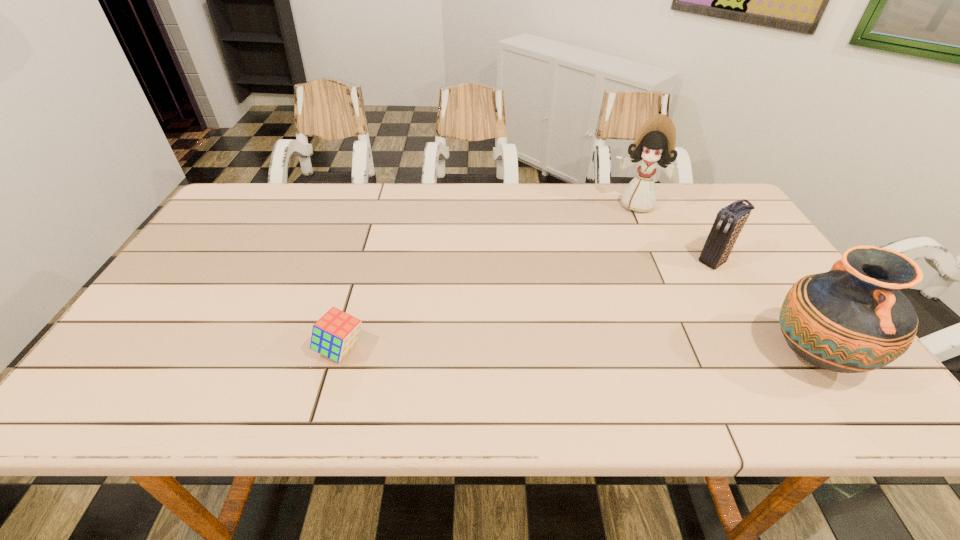
I want to click on free space located with the zip open on the clutch bag, so click(x=663, y=294).

This screenshot has height=540, width=960. In order to click on free space located 0.320m with the zip open on the clutch bag in this screenshot , I will do `click(624, 319)`.

Identify the location of free space located 0.270m at the front face of the third object from right to left. (619, 271).

Where is `free space located 0.220m at the front face of the third object from right to left`? This screenshot has height=540, width=960. free space located 0.220m at the front face of the third object from right to left is located at coordinates (622, 260).

Where is `free space located 0.360m at the front face of the third object from right to left`? This screenshot has width=960, height=540. free space located 0.360m at the front face of the third object from right to left is located at coordinates (614, 293).

You are a GUI agent. You are given a task and a screenshot of the screen. Output one action in this format:
    pyautogui.click(x=<x>, y=<y>)
    Task: Click on the object positioned at the far edge
    The height and width of the screenshot is (540, 960).
    Given the screenshot: What is the action you would take?
    [654, 146]

Image resolution: width=960 pixels, height=540 pixels. I want to click on cube located in the near edge section of the desktop, so click(x=336, y=332).

Identify the location of pottery that is positioned at the near edge. (852, 319).

You are a GUI agent. You are given a task and a screenshot of the screen. Output one action in this format:
    pyautogui.click(x=<x>, y=<y>)
    Task: Click on the pottery located in the right edge section of the desktop
    This screenshot has width=960, height=540.
    Given the screenshot: What is the action you would take?
    pyautogui.click(x=852, y=319)

At what (x,y) coordinates should I click in order to perform the action: click on clutch bag that is at the right edge. Please return your answer as a coordinate pair (x, y). This screenshot has width=960, height=540. Looking at the image, I should click on (730, 220).